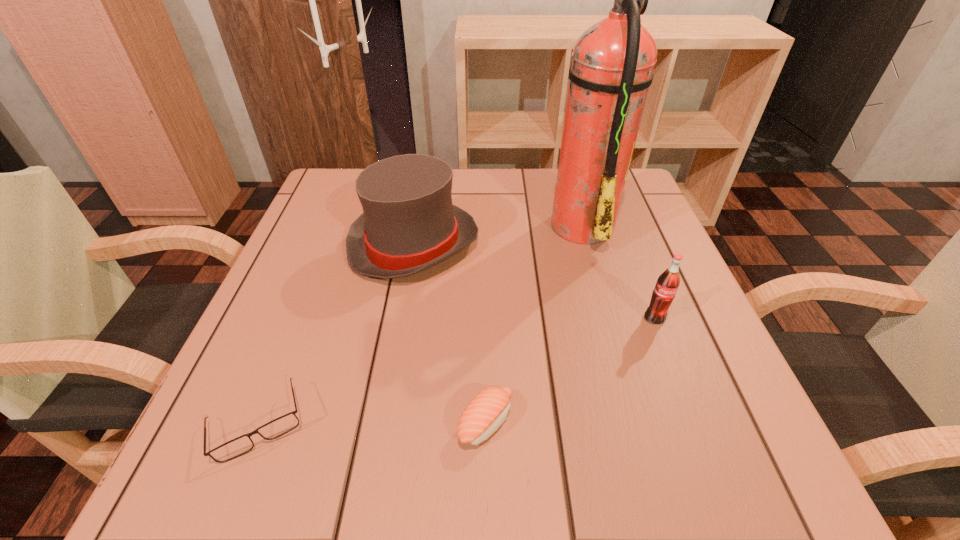
This screenshot has width=960, height=540. I want to click on vacant space located on the back of the fourth tallest object, so click(x=485, y=315).

In order to click on fire extinguisher at the far edge in this screenshot , I will do `click(612, 66)`.

Identify the location of dress hat that is at the far edge. The width and height of the screenshot is (960, 540). (408, 225).

This screenshot has width=960, height=540. In order to click on sushi that is at the near edge in this screenshot , I will do `click(488, 410)`.

This screenshot has height=540, width=960. In order to click on spectacles that is positioned at the near edge in this screenshot , I will do click(232, 449).

Identify the location of dress hat that is at the left edge. (408, 225).

Identify the location of spectacles that is at the left edge. The width and height of the screenshot is (960, 540). [x=232, y=449].

Locate an element on the screen. Image resolution: width=960 pixels, height=540 pixels. fire extinguisher present at the right edge is located at coordinates (612, 66).

Where is `soda bottle that is positioned at the right edge`? The width and height of the screenshot is (960, 540). soda bottle that is positioned at the right edge is located at coordinates (668, 282).

I want to click on object at the far left corner, so click(408, 225).